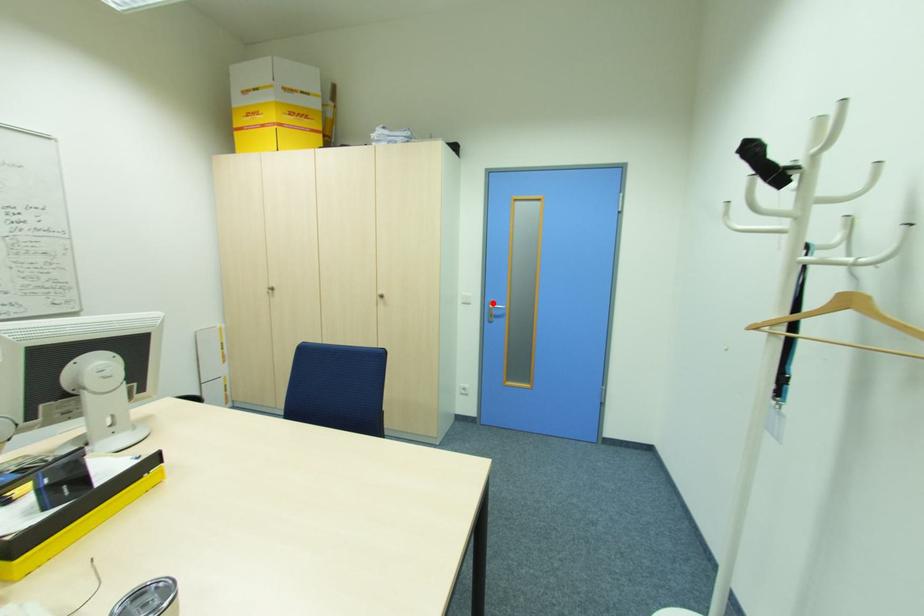
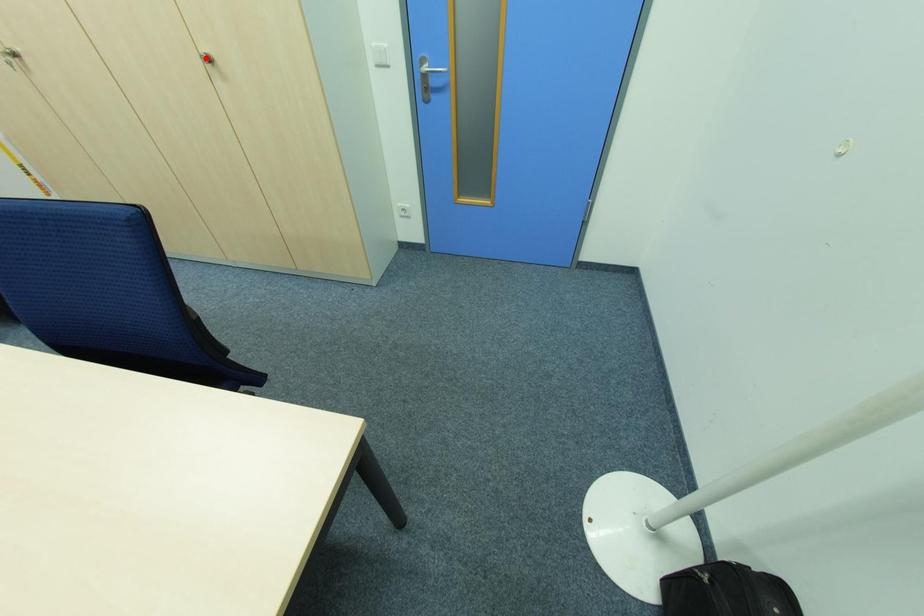
I am providing you with two images of the same scene from different viewpoints. A red point is marked on the first image and another point is marked on the second image. Is the marked point in image1 the same physical position as the marked point in image2?

No